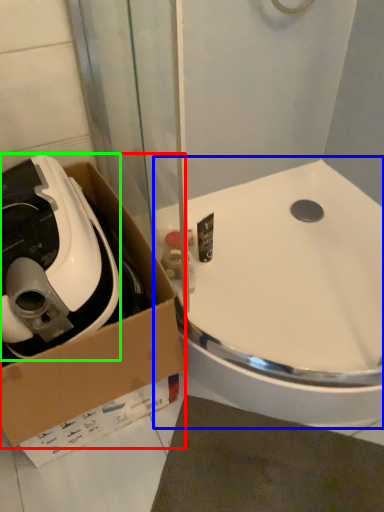
Question: Estimate the real-world distances between objects in this image. Which object is closer to box (highlighted by a red box), sink (highlighted by a blue box) or appliance (highlighted by a green box)?

Choices:
 (A) sink
 (B) appliance

Answer: (B)